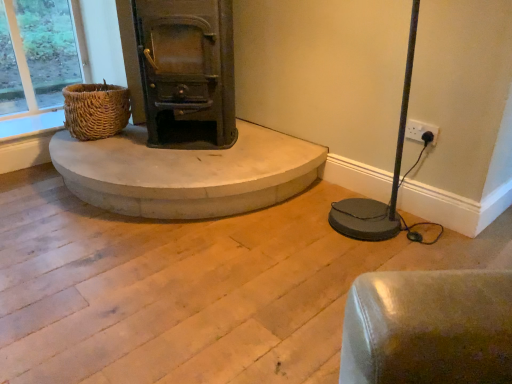
You are a GUI agent. You are given a task and a screenshot of the screen. Output one action in this format:
    pyautogui.click(x=<x>, y=<y>)
    Task: Click on the smooth concrete hearth at center
    The width and height of the screenshot is (512, 384).
    Given the screenshot: What is the action you would take?
    pyautogui.click(x=186, y=173)

Image resolution: width=512 pixels, height=384 pixels. Describe the element at coordinates (186, 173) in the screenshot. I see `smooth concrete hearth at center` at that location.

The height and width of the screenshot is (384, 512). What are the coordinates of `woven brown basket at left` in the screenshot? It's located at (95, 110).

The width and height of the screenshot is (512, 384). Describe the element at coordinates (95, 110) in the screenshot. I see `woven brown basket at left` at that location.

I want to click on smooth concrete hearth at center, so click(186, 173).

Visually, is woven brown basket at left positioned to the left or to the right of smooth concrete hearth at center?

Clearly, woven brown basket at left is on the left of smooth concrete hearth at center in the image.

Considering the positions of objects woven brown basket at left and smooth concrete hearth at center in the image provided, who is behind, woven brown basket at left or smooth concrete hearth at center?

woven brown basket at left.

Which point is more distant from viewer, (121, 117) or (151, 169)?

Positioned behind is point (121, 117).

Based on the photo, from the image's perspective, is woven brown basket at left located above or below smooth concrete hearth at center?

Clearly, from the image's perspective, woven brown basket at left is above smooth concrete hearth at center.

From a real-world perspective, does woven brown basket at left sit lower than smooth concrete hearth at center?

No, from a real-world perspective, woven brown basket at left is not beneath smooth concrete hearth at center.

Considering the relative sizes of woven brown basket at left and smooth concrete hearth at center in the image provided, is woven brown basket at left thinner than smooth concrete hearth at center?

Yes.

Is woven brown basket at left taller or shorter than smooth concrete hearth at center?

woven brown basket at left is taller than smooth concrete hearth at center.

Considering the relative sizes of woven brown basket at left and smooth concrete hearth at center in the image provided, is woven brown basket at left bigger than smooth concrete hearth at center?

No.

In the scene shown: Would you say woven brown basket at left is inside or outside smooth concrete hearth at center?

woven brown basket at left cannot be found inside smooth concrete hearth at center.

Is woven brown basket at left positioned far away from smooth concrete hearth at center?

No, there isn't a large distance between woven brown basket at left and smooth concrete hearth at center.

Is smooth concrete hearth at center at the back of woven brown basket at left?

No, smooth concrete hearth at center is not at the back of woven brown basket at left.

Consider the image. How different are the orientations of woven brown basket at left and smooth concrete hearth at center in degrees?

woven brown basket at left and smooth concrete hearth at center are facing 2.52 degrees away from each other.

This screenshot has height=384, width=512. In the image, there is a smooth concrete hearth at center. Find the location of `basket above it (from the image's perspective)`. basket above it (from the image's perspective) is located at coordinates (95, 110).

Visually, is smooth concrete hearth at center positioned to the left or to the right of woven brown basket at left?

Clearly, smooth concrete hearth at center is on the right of woven brown basket at left in the image.

Considering the positions of objects smooth concrete hearth at center and woven brown basket at left in the image provided, who is behind, smooth concrete hearth at center or woven brown basket at left?

woven brown basket at left is behind.

Which is more distant, (148, 192) or (127, 109)?

The point (127, 109) is farther.

From the image's perspective, which one is positioned higher, smooth concrete hearth at center or woven brown basket at left?

woven brown basket at left appears higher in the image.

From a real-world perspective, is smooth concrete hearth at center positioned above or below woven brown basket at left?

Clearly, from a real-world perspective, smooth concrete hearth at center is below woven brown basket at left.

Does smooth concrete hearth at center have a greater width compared to woven brown basket at left?

Yes.

Is smooth concrete hearth at center taller or shorter than woven brown basket at left?

In the image, smooth concrete hearth at center appears to be shorter than woven brown basket at left.

Is smooth concrete hearth at center bigger or smaller than woven brown basket at left?

In the image, smooth concrete hearth at center appears to be larger than woven brown basket at left.

Is smooth concrete hearth at center inside or outside of woven brown basket at left?

smooth concrete hearth at center is outside woven brown basket at left.

Is smooth concrete hearth at center touching woven brown basket at left?

No, smooth concrete hearth at center is not beside woven brown basket at left.

Is woven brown basket at left at the back of smooth concrete hearth at center?

smooth concrete hearth at center is not turned away from woven brown basket at left.

Locate an element on the screen. basket located on the left of smooth concrete hearth at center is located at coordinates point(95,110).

Identify the location of basket located behind the smooth concrete hearth at center. Image resolution: width=512 pixels, height=384 pixels. (95, 110).

Find the location of a particular element. The width and height of the screenshot is (512, 384). basket above the smooth concrete hearth at center (from a real-world perspective) is located at coordinates (95, 110).